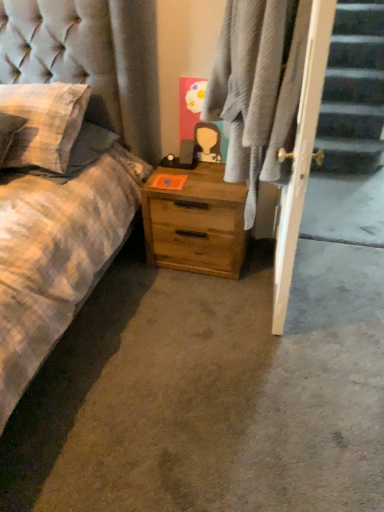
Question: Is checkered fabric pillow at left to the left of plaid fabric at center from the viewer's perspective?

Choices:
 (A) no
 (B) yes

Answer: (B)

Question: Can you confirm if checkered fabric pillow at left is taller than plaid fabric at center?

Choices:
 (A) yes
 (B) no

Answer: (B)

Question: Is checkered fabric pillow at left wider than plaid fabric at center?

Choices:
 (A) no
 (B) yes

Answer: (B)

Question: Is checkered fabric pillow at left turned away from plaid fabric at center?

Choices:
 (A) no
 (B) yes

Answer: (A)

Question: From the image's perspective, is checkered fabric pillow at left on plaid fabric at center?

Choices:
 (A) yes
 (B) no

Answer: (A)

Question: In the image, is plaid fabric at center on the left side or the right side of wooden nightstand at center?

Choices:
 (A) right
 (B) left

Answer: (A)

Question: From the image's perspective, is plaid fabric at center above or below wooden nightstand at center?

Choices:
 (A) above
 (B) below

Answer: (A)

Question: Considering the positions of point (253, 10) and point (208, 247), is point (253, 10) closer or farther from the camera than point (208, 247)?

Choices:
 (A) closer
 (B) farther

Answer: (A)

Question: Relative to wooden nightstand at center, is plaid fabric at center in front or behind?

Choices:
 (A) behind
 (B) front

Answer: (B)

Question: Considering the positions of wooden nightstand at center and checkered fabric pillow at left in the image, is wooden nightstand at center bigger or smaller than checkered fabric pillow at left?

Choices:
 (A) big
 (B) small

Answer: (A)

Question: In terms of height, does wooden nightstand at center look taller or shorter compared to checkered fabric pillow at left?

Choices:
 (A) tall
 (B) short

Answer: (A)

Question: From the image's perspective, is wooden nightstand at center above or below checkered fabric pillow at left?

Choices:
 (A) above
 (B) below

Answer: (B)

Question: Considering the positions of wooden nightstand at center and checkered fabric pillow at left in the image, is wooden nightstand at center wider or thinner than checkered fabric pillow at left?

Choices:
 (A) thin
 (B) wide

Answer: (A)

Question: Based on their sizes in the image, would you say plaid fabric at center is bigger or smaller than checkered fabric pillow at left?

Choices:
 (A) big
 (B) small

Answer: (A)

Question: Is plaid fabric at center spatially inside checkered fabric pillow at left, or outside of it?

Choices:
 (A) outside
 (B) inside

Answer: (A)